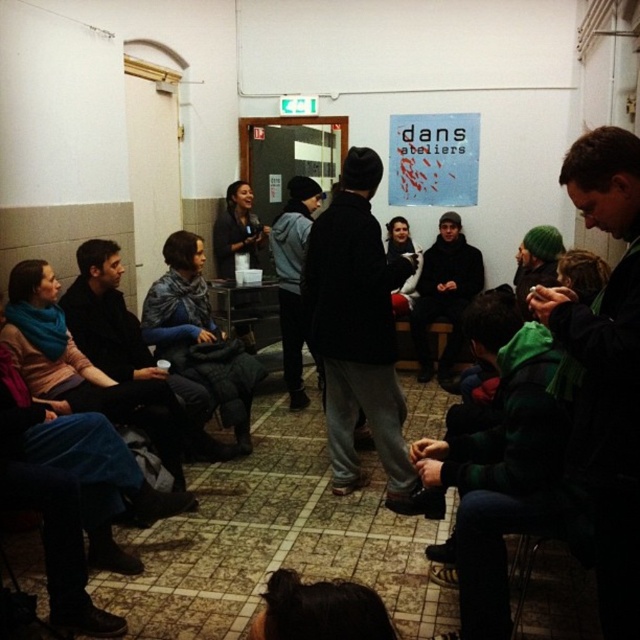
You are standing in the room and want to move from point (396,275) to point (102,342). Which direction should you move to get closer to the second point?

You should move downward and to the right because point (102,342) is located lower and to the right compared to point (396,275).

Looking at this image, you are organizing a charity event and need to place a small donation box on a table. The table has limited space. You have two items to consider placing there first, the dark gray knit hat at center and the dark blue sweater at center. Which item should you place first to ensure both fit on the table?

The dark gray knit hat at center is bigger than the dark blue sweater at center, so you should place the dark gray knit hat at center first to ensure both items fit on the table.